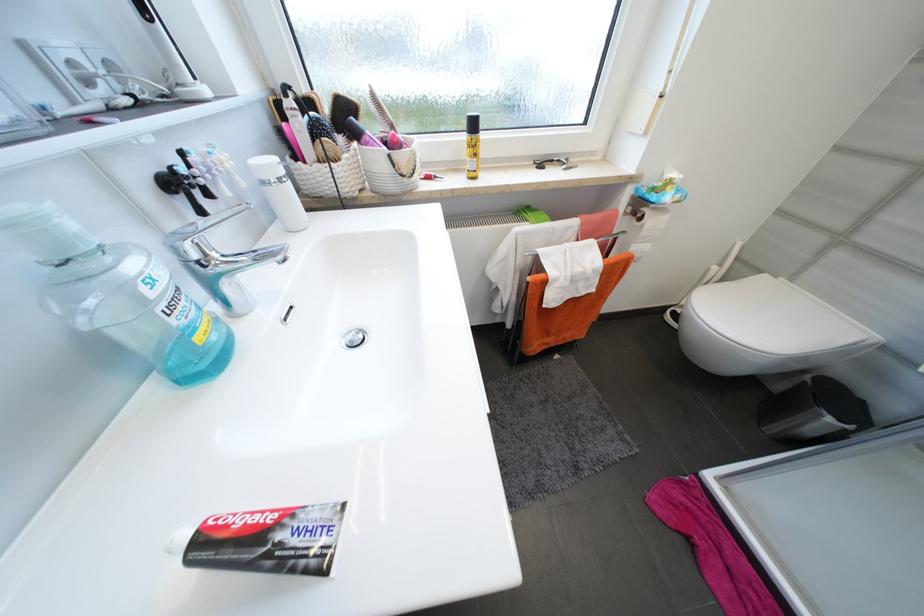
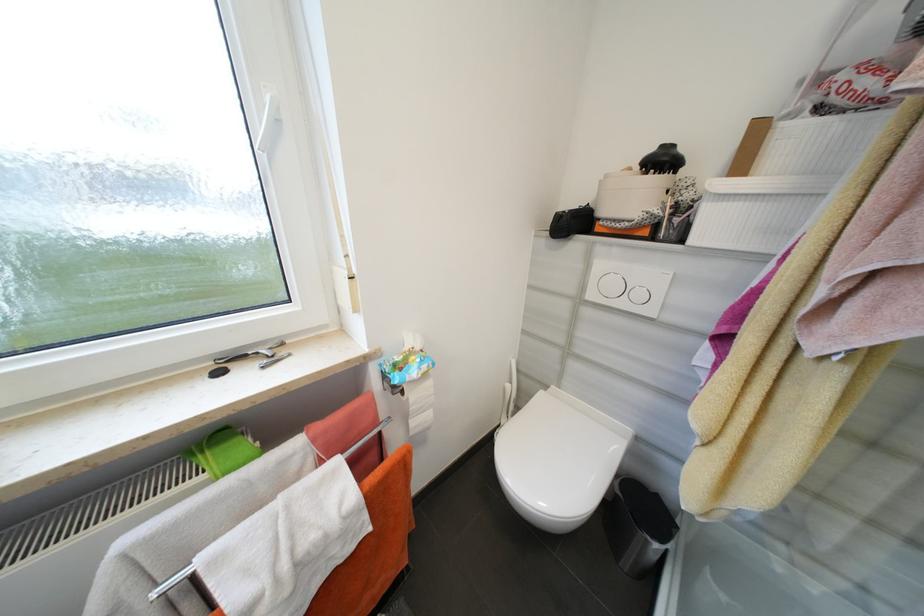
Where in the second image is the point corresponding to point 721,269 from the first image?

(514, 387)